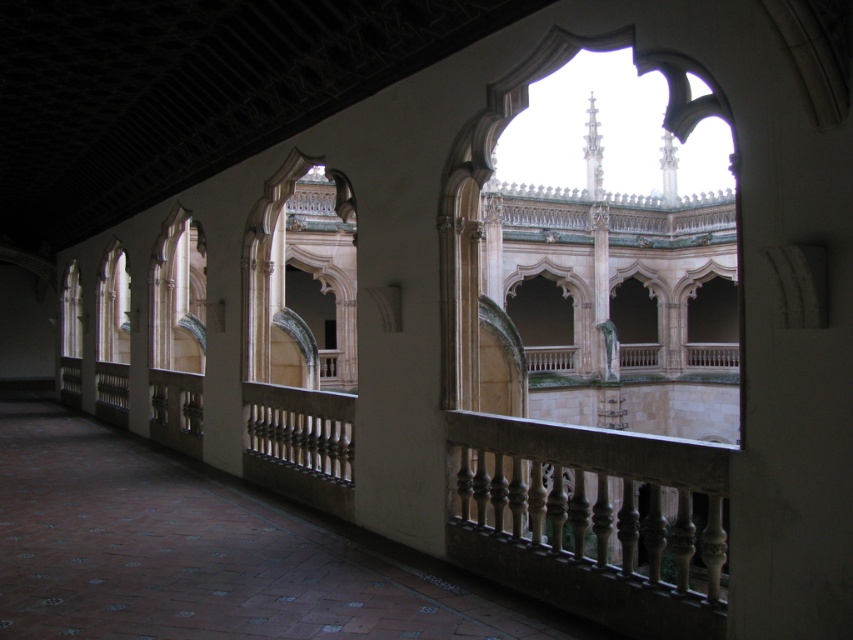
You are an architect designing a new building and want to incorporate two types of windows in the central corridor. The scene shows a matte glass window at center and a clear glass window at center. Which window type is larger in size?

The matte glass window at center is bigger than the clear glass window at center, so the matte glass window is the larger one.

You are an architect analyzing the symmetry of the corridor. Which of the two windows, the matte glass window at center or the clear glass window at center, is positioned higher on the wall?

The matte glass window at center is positioned higher on the wall because it is much taller than the clear glass window at center.